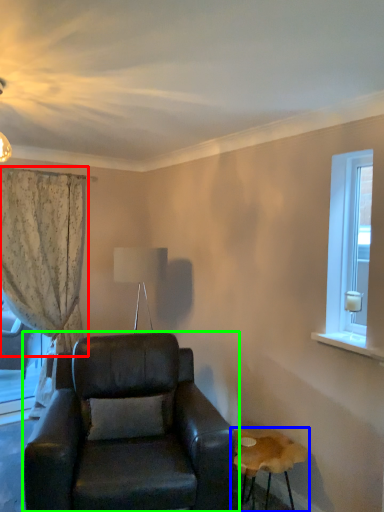
Question: Which object is positioned farthest from curtain (highlighted by a red box)? Select from table (highlighted by a blue box) and chair (highlighted by a green box).

Choices:
 (A) table
 (B) chair

Answer: (A)